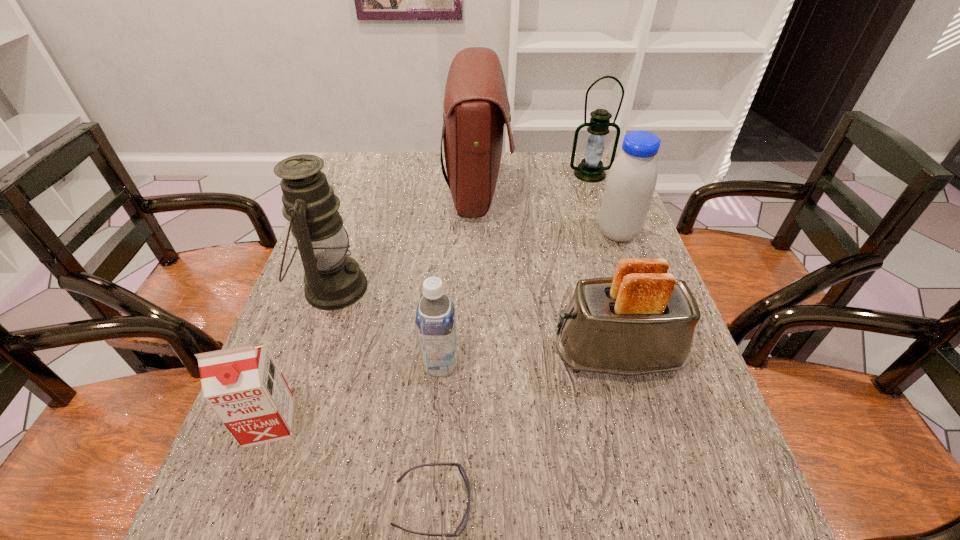
Image resolution: width=960 pixels, height=540 pixels. Identify the location of vacant space that satisfies the following two spatial constraints: 1. on the open flap of the satchel; 2. on the right side of the tallest soya milk. (477, 233).